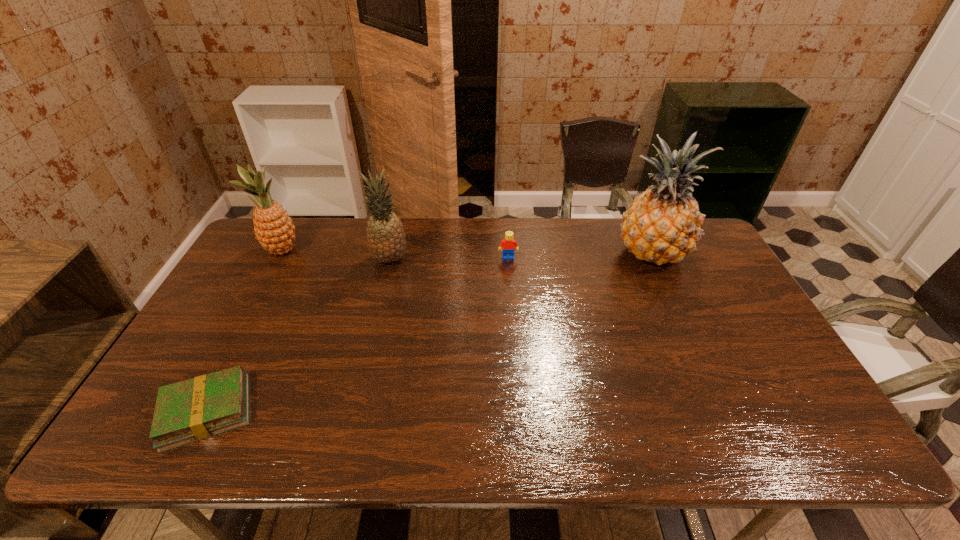
This screenshot has width=960, height=540. I want to click on blank area in the image that satisfies the following two spatial constraints: 1. on the back side of the rightmost pineapple; 2. on the right side of the third object from left to right, so click(x=392, y=253).

Image resolution: width=960 pixels, height=540 pixels. I want to click on free space that satisfies the following two spatial constraints: 1. on the front side of the rightmost pineapple; 2. on the left side of the leftmost pineapple, so click(x=281, y=253).

The image size is (960, 540). What are the coordinates of `vacant region that satisfies the following two spatial constraints: 1. on the back side of the rightmost pineapple; 2. on the right side of the book` in the screenshot? It's located at (288, 253).